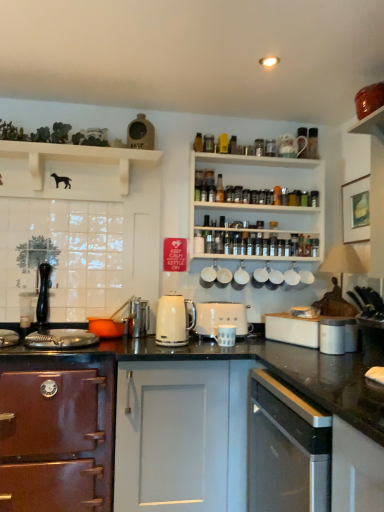
Question: Considering the relative sizes of white matte toaster at center, which is counted as the 7th appliance, starting from the right, and white matte coffee cup at center, the ninth appliance when ordered from left to right, in the image provided, is white matte toaster at center, which is counted as the 7th appliance, starting from the right, bigger than white matte coffee cup at center, the ninth appliance when ordered from left to right,?

Choices:
 (A) yes
 (B) no

Answer: (A)

Question: Is white matte toaster at center, which is counted as the 7th appliance, starting from the right, smaller than white matte coffee cup at center, the first appliance positioned from the right?

Choices:
 (A) no
 (B) yes

Answer: (A)

Question: Does white matte toaster at center, which is the 3th appliance from left to right, appear on the right side of white matte coffee cup at center, the first appliance positioned from the right?

Choices:
 (A) no
 (B) yes

Answer: (A)

Question: Is white matte toaster at center, which is the 3th appliance from left to right, positioned beyond the bounds of white matte coffee cup at center, the first appliance positioned from the right?

Choices:
 (A) no
 (B) yes

Answer: (B)

Question: From the image's perspective, is white matte toaster at center, which is counted as the 7th appliance, starting from the right, located beneath white matte coffee cup at center, the ninth appliance when ordered from left to right?

Choices:
 (A) yes
 (B) no

Answer: (A)

Question: Are white matte toaster at center, which is counted as the 7th appliance, starting from the right, and white matte coffee cup at center, the ninth appliance when ordered from left to right, located far from each other?

Choices:
 (A) no
 (B) yes

Answer: (A)

Question: From the image's perspective, is satin silver dishwasher at lower right, placed as the 1th cabinetry when sorted from right to left, under black matte faucet at left?

Choices:
 (A) yes
 (B) no

Answer: (A)

Question: Is satin silver dishwasher at lower right, acting as the second cabinetry starting from the left, smaller than black matte faucet at left?

Choices:
 (A) no
 (B) yes

Answer: (A)

Question: Does satin silver dishwasher at lower right, acting as the second cabinetry starting from the left, contain black matte faucet at left?

Choices:
 (A) no
 (B) yes

Answer: (A)

Question: Is satin silver dishwasher at lower right, acting as the second cabinetry starting from the left, in contact with black matte faucet at left?

Choices:
 (A) yes
 (B) no

Answer: (B)

Question: Could you tell me if satin silver dishwasher at lower right, acting as the second cabinetry starting from the left, is turned towards black matte faucet at left?

Choices:
 (A) no
 (B) yes

Answer: (A)

Question: Considering the relative sizes of satin silver dishwasher at lower right, acting as the second cabinetry starting from the left, and black matte faucet at left in the image provided, is satin silver dishwasher at lower right, acting as the second cabinetry starting from the left, taller than black matte faucet at left?

Choices:
 (A) no
 (B) yes

Answer: (B)

Question: Can you confirm if white wooden shelf at upper center, positioned as the first shelf in right-to-left order, is bigger than white matte cup at upper center, which ranks as the eighth appliance in left-to-right order?

Choices:
 (A) yes
 (B) no

Answer: (A)